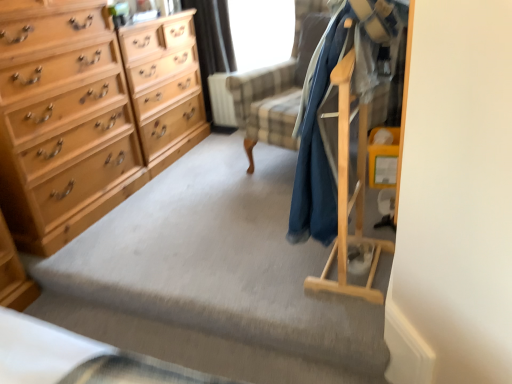
Question: Is light wood chest of drawers at left completely or partially outside of dark blue fabric coat at right?

Choices:
 (A) yes
 (B) no

Answer: (A)

Question: From a real-world perspective, is light wood chest of drawers at left under dark blue fabric coat at right?

Choices:
 (A) no
 (B) yes

Answer: (B)

Question: Is light wood chest of drawers at left taller than dark blue fabric coat at right?

Choices:
 (A) no
 (B) yes

Answer: (B)

Question: Is light wood chest of drawers at left in front of dark blue fabric coat at right?

Choices:
 (A) no
 (B) yes

Answer: (A)

Question: Considering the relative sizes of light wood chest of drawers at left and dark blue fabric coat at right in the image provided, is light wood chest of drawers at left wider than dark blue fabric coat at right?

Choices:
 (A) yes
 (B) no

Answer: (A)

Question: From a real-world perspective, is light wood chest of drawers at left located higher than dark blue fabric coat at right?

Choices:
 (A) no
 (B) yes

Answer: (A)

Question: Is the position of light wood chest of drawers at left more distant than that of transparent plastic window screen at upper center?

Choices:
 (A) no
 (B) yes

Answer: (A)

Question: From the image's perspective, is light wood chest of drawers at left beneath transparent plastic window screen at upper center?

Choices:
 (A) no
 (B) yes

Answer: (B)

Question: Does light wood chest of drawers at left have a lesser width compared to transparent plastic window screen at upper center?

Choices:
 (A) no
 (B) yes

Answer: (A)

Question: Is light wood chest of drawers at left touching transparent plastic window screen at upper center?

Choices:
 (A) no
 (B) yes

Answer: (A)

Question: Is light wood chest of drawers at left not inside transparent plastic window screen at upper center?

Choices:
 (A) yes
 (B) no

Answer: (A)

Question: Is light wood chest of drawers at left looking in the opposite direction of transparent plastic window screen at upper center?

Choices:
 (A) yes
 (B) no

Answer: (B)

Question: Is black fabric curtain at upper center facing away from light wood chest of drawers at left?

Choices:
 (A) no
 (B) yes

Answer: (A)